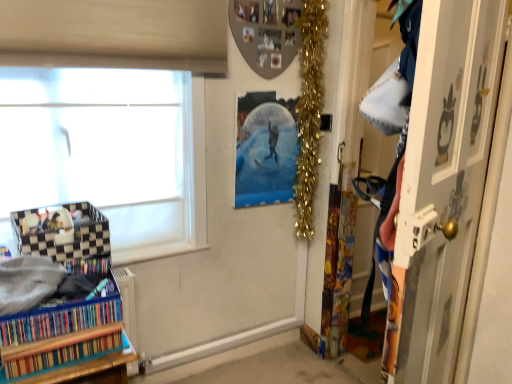
Question: Considering the relative sizes of multicolored cardboard at lower left, which is the second book from bottom to top, and multicolored cardboard book at lower left, which is counted as the 1th book, starting from the bottom, in the image provided, is multicolored cardboard at lower left, which is the second book from bottom to top, wider than multicolored cardboard book at lower left, which is counted as the 1th book, starting from the bottom,?

Choices:
 (A) no
 (B) yes

Answer: (A)

Question: Is multicolored cardboard at lower left, which is the second book from bottom to top, further to the viewer compared to multicolored cardboard book at lower left, which is counted as the 1th book, starting from the bottom?

Choices:
 (A) yes
 (B) no

Answer: (A)

Question: Are multicolored cardboard at lower left, placed as the 1th book when sorted from top to bottom, and multicolored cardboard book at lower left, which is the second book from top to bottom, far apart?

Choices:
 (A) no
 (B) yes

Answer: (A)

Question: Is multicolored cardboard at lower left, which is the second book from bottom to top, bigger than multicolored cardboard book at lower left, which is counted as the 1th book, starting from the bottom?

Choices:
 (A) yes
 (B) no

Answer: (A)

Question: Is the surface of multicolored cardboard at lower left, which is the second book from bottom to top, in direct contact with multicolored cardboard book at lower left, which is counted as the 1th book, starting from the bottom?

Choices:
 (A) yes
 (B) no

Answer: (A)

Question: Considering the positions of point (267, 104) and point (309, 198), is point (267, 104) closer or farther from the camera than point (309, 198)?

Choices:
 (A) farther
 (B) closer

Answer: (B)

Question: Is metallic silver snow globe at upper center situated inside gold tinsel garland at upper right or outside?

Choices:
 (A) outside
 (B) inside

Answer: (A)

Question: From a real-world perspective, is metallic silver snow globe at upper center positioned above or below gold tinsel garland at upper right?

Choices:
 (A) below
 (B) above

Answer: (A)

Question: Looking at their shapes, would you say metallic silver snow globe at upper center is wider or thinner than gold tinsel garland at upper right?

Choices:
 (A) wide
 (B) thin

Answer: (B)

Question: From the image's perspective, is multicolored cardboard book at lower left, which is the second book from top to bottom, above or below white frosted glass window at left?

Choices:
 (A) above
 (B) below

Answer: (B)

Question: Considering the positions of multicolored cardboard book at lower left, which is the second book from top to bottom, and white frosted glass window at left in the image, is multicolored cardboard book at lower left, which is the second book from top to bottom, wider or thinner than white frosted glass window at left?

Choices:
 (A) thin
 (B) wide

Answer: (B)

Question: Considering the relative positions of multicolored cardboard book at lower left, which is counted as the 1th book, starting from the bottom, and white frosted glass window at left in the image provided, is multicolored cardboard book at lower left, which is counted as the 1th book, starting from the bottom, to the left or to the right of white frosted glass window at left?

Choices:
 (A) right
 (B) left

Answer: (A)

Question: From a real-world perspective, is multicolored cardboard book at lower left, which is counted as the 1th book, starting from the bottom, physically located above or below white frosted glass window at left?

Choices:
 (A) above
 (B) below

Answer: (B)

Question: From the image's perspective, is gold tinsel garland at upper right located above or below multicolored cardboard book at lower left, which is counted as the 1th book, starting from the bottom?

Choices:
 (A) above
 (B) below

Answer: (A)

Question: Relative to multicolored cardboard book at lower left, which is the second book from top to bottom, is gold tinsel garland at upper right in front or behind?

Choices:
 (A) behind
 (B) front

Answer: (A)